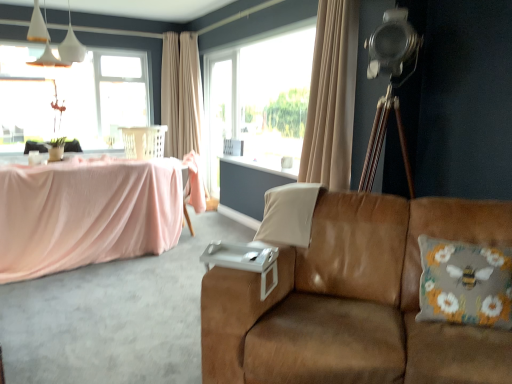
Image resolution: width=512 pixels, height=384 pixels. Describe the element at coordinates (220, 112) in the screenshot. I see `transparent glass screen door at center` at that location.

What are the coordinates of `beige fabric curtain at upper center, positioned as the second curtain in back-to-front order` in the screenshot? It's located at (331, 97).

Image resolution: width=512 pixels, height=384 pixels. Identify the location of transparent glass window at upper left. (73, 97).

Does beige fabric curtain at upper center, the 1th curtain viewed from the front, appear on the right side of white matte pendant lights at upper left?

Correct, you'll find beige fabric curtain at upper center, the 1th curtain viewed from the front, to the right of white matte pendant lights at upper left.

From a real-world perspective, is beige fabric curtain at upper center, which is counted as the first curtain, starting from the right, positioned under white matte pendant lights at upper left based on gravity?

Correct, in the physical world, beige fabric curtain at upper center, which is counted as the first curtain, starting from the right, is lower than white matte pendant lights at upper left.

Where is `the 2nd curtain positioned below the white matte pendant lights at upper left (from the image's perspective)`? This screenshot has width=512, height=384. the 2nd curtain positioned below the white matte pendant lights at upper left (from the image's perspective) is located at coordinates (331, 97).

Is beige fabric curtain at upper center, the 1th curtain viewed from the front, surrounding white matte pendant lights at upper left?

No, beige fabric curtain at upper center, the 1th curtain viewed from the front, does not contain white matte pendant lights at upper left.

What's the angular difference between white plastic swivel chair at upper center and beige fabric curtain at upper center, arranged as the second curtain when viewed from the left,'s facing directions?

There is a 89.2-degree angle between the facing directions of white plastic swivel chair at upper center and beige fabric curtain at upper center, arranged as the second curtain when viewed from the left.

From a real-world perspective, is white plastic swivel chair at upper center physically below beige fabric curtain at upper center, positioned as the second curtain in back-to-front order?

Yes, from a real-world perspective, white plastic swivel chair at upper center is under beige fabric curtain at upper center, positioned as the second curtain in back-to-front order.

Is white plastic swivel chair at upper center located outside beige fabric curtain at upper center, the 1th curtain viewed from the front?

white plastic swivel chair at upper center lies outside beige fabric curtain at upper center, the 1th curtain viewed from the front,'s area.

Locate an element on the screen. The height and width of the screenshot is (384, 512). swivel chair directly beneath the beige fabric curtain at upper center, the 1th curtain viewed from the front (from a real-world perspective) is located at coordinates (144, 141).

Between transparent glass screen door at center and white plastic side table at lower right, which one has more height?

Standing taller between the two is transparent glass screen door at center.

Considering the relative sizes of transparent glass screen door at center and white plastic side table at lower right in the image provided, is transparent glass screen door at center thinner than white plastic side table at lower right?

Yes.

Is transparent glass screen door at center in front of or behind white plastic side table at lower right in the image?

transparent glass screen door at center is positioned farther from the viewer than white plastic side table at lower right.

From the image's perspective, does transparent glass window at upper left appear lower than floral-patterned fabric pillow at right, the 1th pillow in the front-to-back sequence?

Incorrect, from the image's perspective, transparent glass window at upper left is higher than floral-patterned fabric pillow at right, the 1th pillow in the front-to-back sequence.

Could you tell me if transparent glass window at upper left is turned towards floral-patterned fabric pillow at right, which ranks as the 2th pillow in back-to-front order?

Yes, transparent glass window at upper left faces towards floral-patterned fabric pillow at right, which ranks as the 2th pillow in back-to-front order.

Consider the image. Would you consider transparent glass window at upper left to be distant from floral-patterned fabric pillow at right, the first pillow viewed from the right?

Yes, transparent glass window at upper left and floral-patterned fabric pillow at right, the first pillow viewed from the right, are quite far apart.

Would you say transparent glass window at upper left contains floral-patterned fabric pillow at right, which ranks as the 2th pillow in back-to-front order?

That's incorrect, floral-patterned fabric pillow at right, which ranks as the 2th pillow in back-to-front order, is not inside transparent glass window at upper left.

You are a GUI agent. You are given a task and a screenshot of the screen. Output one action in this format:
    pyautogui.click(x=<x>, y=<y>)
    Task: Click on the fixture above the white plastic side table at lower right (from the image's perspective)
    
    Given the screenshot: What is the action you would take?
    pyautogui.click(x=49, y=41)

Which of these two, white matte pendant lights at upper left or white plastic side table at lower right, stands taller?

white matte pendant lights at upper left.

Is white matte pendant lights at upper left surrounding white plastic side table at lower right?

No, white matte pendant lights at upper left does not contain white plastic side table at lower right.

Are white matte pendant lights at upper left and white plastic side table at lower right making contact?

They are not placed beside each other.

Is brown suede couch at center located outside white fabric pillow at center, marked as the first pillow in a left-to-right arrangement?

Yes, brown suede couch at center is not within white fabric pillow at center, marked as the first pillow in a left-to-right arrangement.

Looking at this image, who is taller, brown suede couch at center or white fabric pillow at center, marked as the first pillow in a back-to-front arrangement?

Standing taller between the two is brown suede couch at center.

Does brown suede couch at center appear on the left side of white fabric pillow at center, marked as the 2th pillow in a front-to-back arrangement?

No, brown suede couch at center is not to the left of white fabric pillow at center, marked as the 2th pillow in a front-to-back arrangement.

In terms of width, does brown suede couch at center look wider or thinner when compared to white fabric pillow at center, the 2th pillow positioned from the right?

Considering their sizes, brown suede couch at center looks broader than white fabric pillow at center, the 2th pillow positioned from the right.

Is transparent glass window at upper left closer to camera compared to beige fabric curtain at upper center, arranged as the second curtain when viewed from the left?

No, transparent glass window at upper left is further to the viewer.

From a real-world perspective, is transparent glass window at upper left above or below beige fabric curtain at upper center, arranged as the second curtain when viewed from the left?

From a real-world perspective, transparent glass window at upper left is physically above beige fabric curtain at upper center, arranged as the second curtain when viewed from the left.

Which is more to the right, transparent glass window at upper left or beige fabric curtain at upper center, arranged as the second curtain when viewed from the left?

beige fabric curtain at upper center, arranged as the second curtain when viewed from the left, is more to the right.

Consider the image. Can you confirm if transparent glass window at upper left is bigger than beige fabric curtain at upper center, arranged as the second curtain when viewed from the left?

No.

Where is `fixture that is above the beige fabric curtain at upper center, positioned as the second curtain in back-to-front order (from a real-world perspective)`? The height and width of the screenshot is (384, 512). fixture that is above the beige fabric curtain at upper center, positioned as the second curtain in back-to-front order (from a real-world perspective) is located at coordinates tap(49, 41).

Where is `swivel chair below the beige fabric curtain at upper center, the 1th curtain viewed from the front (from the image's perspective)`? swivel chair below the beige fabric curtain at upper center, the 1th curtain viewed from the front (from the image's perspective) is located at coordinates (144, 141).

Looking at the image, which one is located further to beige fabric curtain at upper center, arranged as the second curtain when viewed from the left, white plastic side table at lower right or transparent glass screen door at center?

Among the two, transparent glass screen door at center is located further to beige fabric curtain at upper center, arranged as the second curtain when viewed from the left.

From the picture: From the image, which object appears to be farther from white plastic side table at lower right, white fabric pillow at center, the 2th pillow positioned from the right, or beige fabric curtain at upper center, the 1th curtain viewed from the front?

Based on the image, beige fabric curtain at upper center, the 1th curtain viewed from the front, appears to be further to white plastic side table at lower right.

Estimate the real-world distances between objects in this image. Which object is further from beige fabric curtain at upper center, which is counted as the first curtain, starting from the right, white plastic side table at lower right or floral-patterned fabric pillow at right, the first pillow viewed from the right?

floral-patterned fabric pillow at right, the first pillow viewed from the right, is positioned further to the anchor beige fabric curtain at upper center, which is counted as the first curtain, starting from the right.

Looking at the image, which one is located further to floral-patterned fabric pillow at right, which ranks as the 2th pillow in back-to-front order, brown suede couch at center or transparent glass screen door at center?

transparent glass screen door at center.

From the image, which object appears to be farther from brown suede couch at center, transparent glass window at upper left or beige fabric curtain at upper center, the 1th curtain viewed from the front?

transparent glass window at upper left.

Based on the photo, based on their spatial positions, is white plastic swivel chair at upper center or white fabric pillow at center, marked as the 2th pillow in a front-to-back arrangement, further from transparent glass screen door at center?

white fabric pillow at center, marked as the 2th pillow in a front-to-back arrangement, is further to transparent glass screen door at center.

Which object lies further to the anchor point white matte pendant lights at upper left, white plastic swivel chair at upper center or beige fabric curtain at upper center, arranged as the second curtain when viewed from the left?

beige fabric curtain at upper center, arranged as the second curtain when viewed from the left, is further to white matte pendant lights at upper left.

Based on their spatial positions, is beige fabric curtain at upper center, positioned as the second curtain in back-to-front order, or white plastic side table at lower right further from beige fabric curtain at center, which is counted as the first curtain, starting from the left?

white plastic side table at lower right is further to beige fabric curtain at center, which is counted as the first curtain, starting from the left.

At what (x,y) coordinates should I click in order to perform the action: click on window between floral-patterned fabric pillow at right, the 1th pillow in the front-to-back sequence, and beige fabric curtain at center, which is the 2th curtain in right-to-left order, in the front-back direction. Please return your answer as a coordinate pair (x, y). The height and width of the screenshot is (384, 512). Looking at the image, I should click on (73, 97).

You are a GUI agent. You are given a task and a screenshot of the screen. Output one action in this format:
    pyautogui.click(x=<x>, y=<y>)
    Task: Click on the fixture between brown suede couch at center and white plastic swivel chair at upper center in the front-back direction
    The width and height of the screenshot is (512, 384).
    Given the screenshot: What is the action you would take?
    pyautogui.click(x=49, y=41)

Locate an element on the screen. screen door located between transparent glass window at upper left and beige fabric curtain at upper center, which is counted as the first curtain, starting from the right, in the left-right direction is located at coordinates (220, 112).

Identify the location of screen door between white matte pendant lights at upper left and beige fabric curtain at center, marked as the first curtain in a back-to-front arrangement, from front to back. (220, 112).